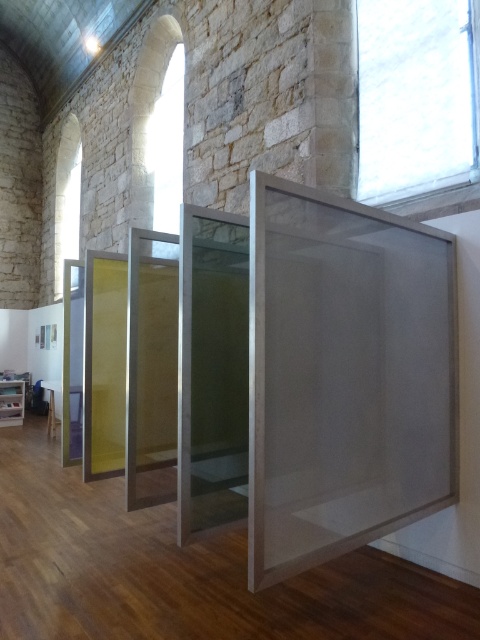
Question: Can you confirm if transparent mesh box at center is thinner than transparent glass box at left?

Choices:
 (A) yes
 (B) no

Answer: (B)

Question: Is the position of transparent mesh box at center less distant than that of transparent glass box at left?

Choices:
 (A) yes
 (B) no

Answer: (A)

Question: Which of the following is the closest to the observer?

Choices:
 (A) (x=19, y=406)
 (B) (x=368, y=461)

Answer: (B)

Question: Can you confirm if transparent mesh box at center is positioned above transparent glass box at left?

Choices:
 (A) yes
 (B) no

Answer: (A)

Question: Which point is closer to the camera?

Choices:
 (A) transparent glass box at left
 (B) transparent mesh box at center

Answer: (B)

Question: Which point is closer to the camera?

Choices:
 (A) (423, 392)
 (B) (3, 385)

Answer: (A)